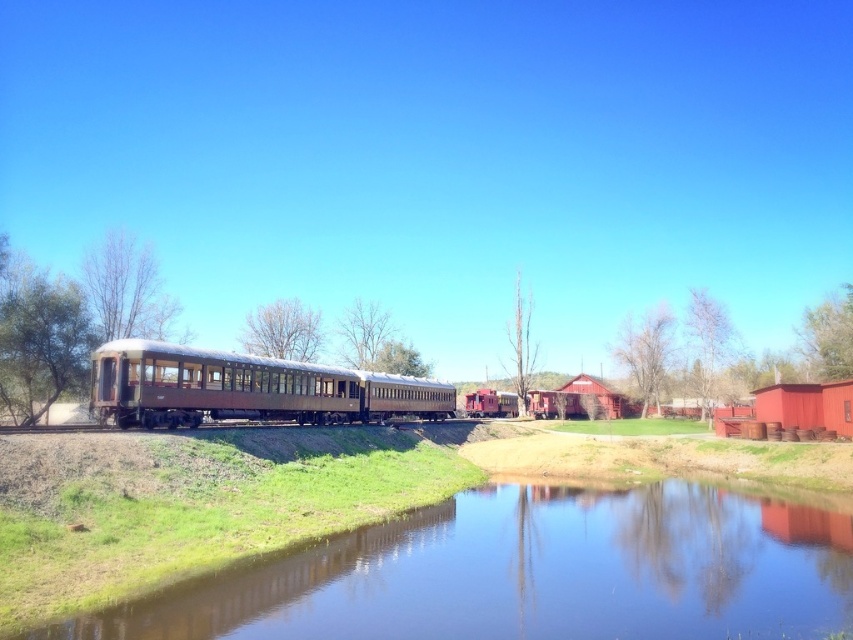
Question: Which point is farther from the camera taking this photo?

Choices:
 (A) (128, 410)
 (B) (445, 608)

Answer: (A)

Question: Which object is farther from the camera taking this photo?

Choices:
 (A) clear water at center
 (B) rusty metal train car at center

Answer: (B)

Question: Which point is closer to the camera?

Choices:
 (A) clear water at center
 (B) rusty metal train car at center

Answer: (A)

Question: Can you confirm if clear water at center is positioned to the right of rusty metal train car at center?

Choices:
 (A) no
 (B) yes

Answer: (B)

Question: Is clear water at center bigger than rusty metal train car at center?

Choices:
 (A) no
 (B) yes

Answer: (A)

Question: Is clear water at center below rusty metal train car at center?

Choices:
 (A) no
 (B) yes

Answer: (B)